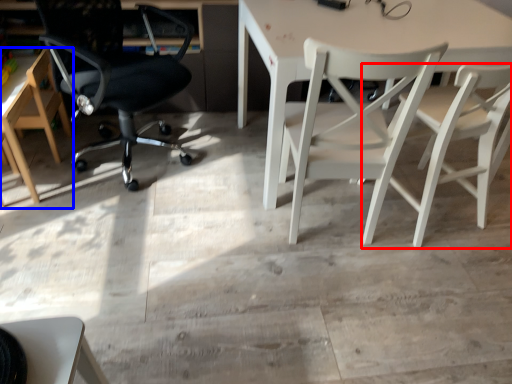
Question: Which of the following is the farthest to the observer, chair (highlighted by a red box) or chair (highlighted by a blue box)?

Choices:
 (A) chair
 (B) chair

Answer: (B)